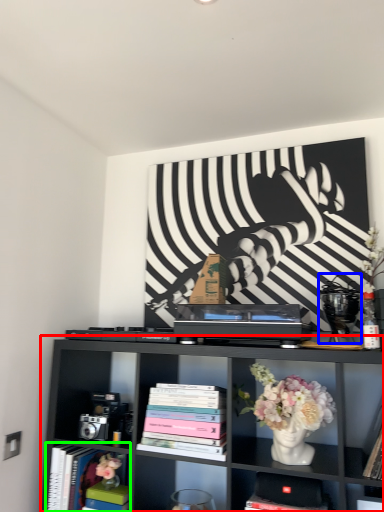
Question: Which is farther away from shelf (highlighted by a red box)? toy (highlighted by a blue box) or book (highlighted by a green box)?

Choices:
 (A) toy
 (B) book

Answer: (A)